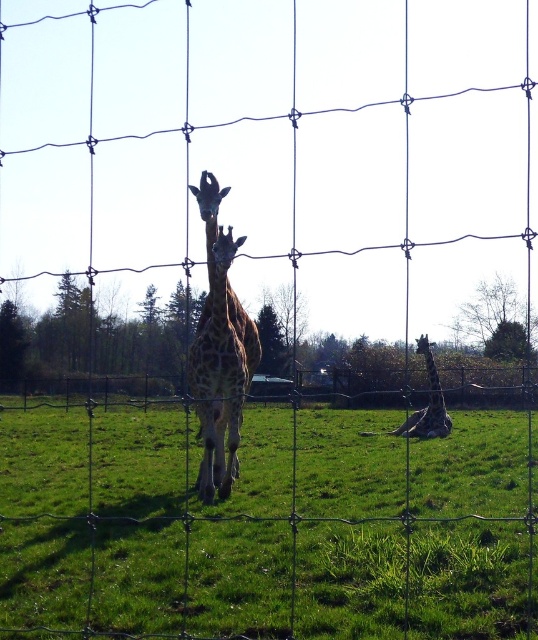
Which of these two, green grass at center or spotted fur giraffe at center, stands taller?

Standing taller between the two is spotted fur giraffe at center.

Which is above, green grass at center or spotted fur giraffe at center?

Positioned higher is spotted fur giraffe at center.

Between point (10, 595) and point (207, 321), which one is positioned in front?

Point (10, 595)

Identify the location of green grass at center. (470, 529).

Who is positioned more to the right, green grass at center or spotted fur giraffe at lower right?

spotted fur giraffe at lower right

Is green grass at center above spotted fur giraffe at lower right?

Actually, green grass at center is below spotted fur giraffe at lower right.

Who is more distant from viewer, (451, 488) or (449, 419)?

The point (449, 419) is more distant.

This screenshot has height=640, width=538. I want to click on green grass at center, so click(x=470, y=529).

Is spotted fur giraffe at center closer to the viewer compared to spotted fur giraffe at lower right?

Yes.

Can you confirm if spotted fur giraffe at center is bigger than spotted fur giraffe at lower right?

No, spotted fur giraffe at center is not bigger than spotted fur giraffe at lower right.

What are the coordinates of `spotted fur giraffe at center` in the screenshot? It's located at (220, 353).